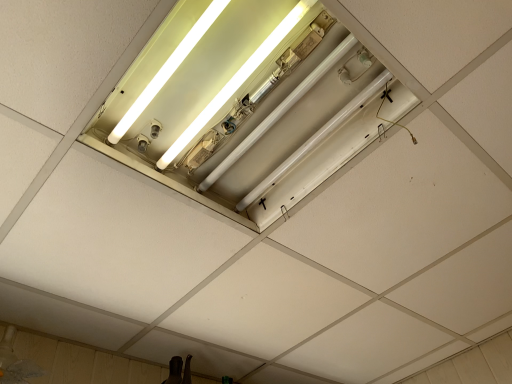
Where is `white fluorescent light at center`? white fluorescent light at center is located at coordinates (254, 110).

In the scene shown: What is the approximate width of white fluorescent light at center?

white fluorescent light at center is 23.04 inches in width.

Describe the element at coordinates (254, 110) in the screenshot. I see `white fluorescent light at center` at that location.

Image resolution: width=512 pixels, height=384 pixels. Identify the location of white fluorescent light at center. (254, 110).